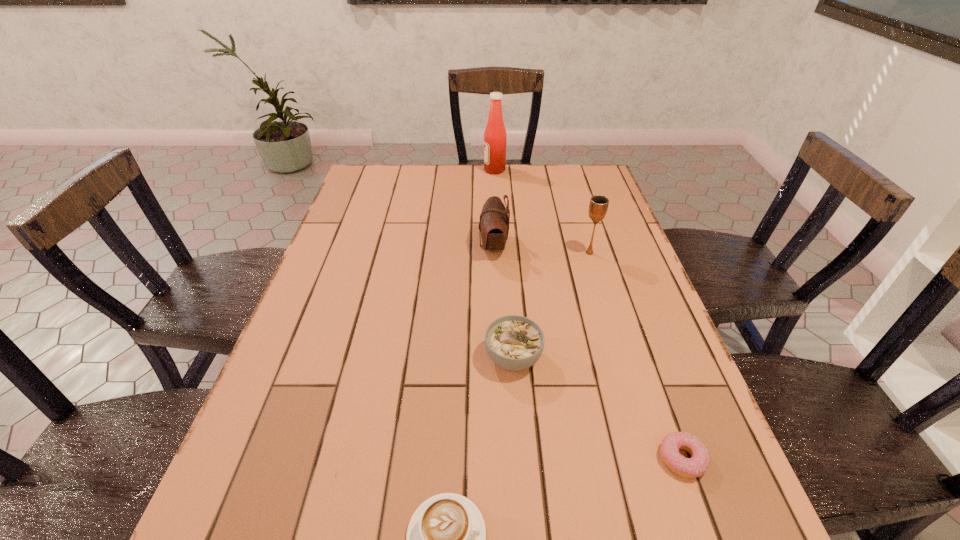
This screenshot has width=960, height=540. Identify the location of blank region between the second nearest object and the fifth shortest object. (636, 356).

Locate which object is the second closest to the nearest object. Please provide its 2D coordinates. Your answer should be formatted as a tuple, i.e. [(x, y)], where the tuple contains the x and y coordinates of a point satisfying the conditions above.

[(698, 464)]

Identify which object is the second closest to the fifth tallest object. Please provide its 2D coordinates. Your answer should be formatted as a tuple, i.e. [(x, y)], where the tuple contains the x and y coordinates of a point satisfying the conditions above.

[(698, 464)]

The height and width of the screenshot is (540, 960). Find the location of `vacant position in the image that satisfies the following two spatial constraints: 1. with the flap open on the shortest object; 2. on the right side of the pouch`. vacant position in the image that satisfies the following two spatial constraints: 1. with the flap open on the shortest object; 2. on the right side of the pouch is located at coordinates click(501, 459).

Identify the location of vacant space that satisfies the following two spatial constraints: 1. on the front-facing side of the farthest object; 2. on the right side of the second tallest object. This screenshot has width=960, height=540. (499, 253).

Where is `blank space that satisfies the following two spatial constraints: 1. on the front-facing side of the tallest object; 2. on the right side of the fifth shortest object`? blank space that satisfies the following two spatial constraints: 1. on the front-facing side of the tallest object; 2. on the right side of the fifth shortest object is located at coordinates (499, 253).

The image size is (960, 540). I want to click on free space that satisfies the following two spatial constraints: 1. on the back side of the fifth shortest object; 2. with the flap open on the pouch, so click(x=588, y=246).

At what (x,y) coordinates should I click in order to perform the action: click on free point that satisfies the following two spatial constraints: 1. with the flap open on the doughnut; 2. on the left side of the fourth shortest object. Please return your answer as a coordinate pair (x, y). Image resolution: width=960 pixels, height=540 pixels. Looking at the image, I should click on (501, 459).